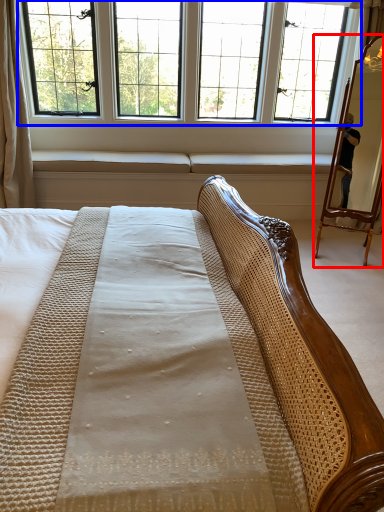
Question: Which object appears closest to the camera in this image, mirror (highlighted by a red box) or window (highlighted by a blue box)?

Choices:
 (A) mirror
 (B) window

Answer: (A)